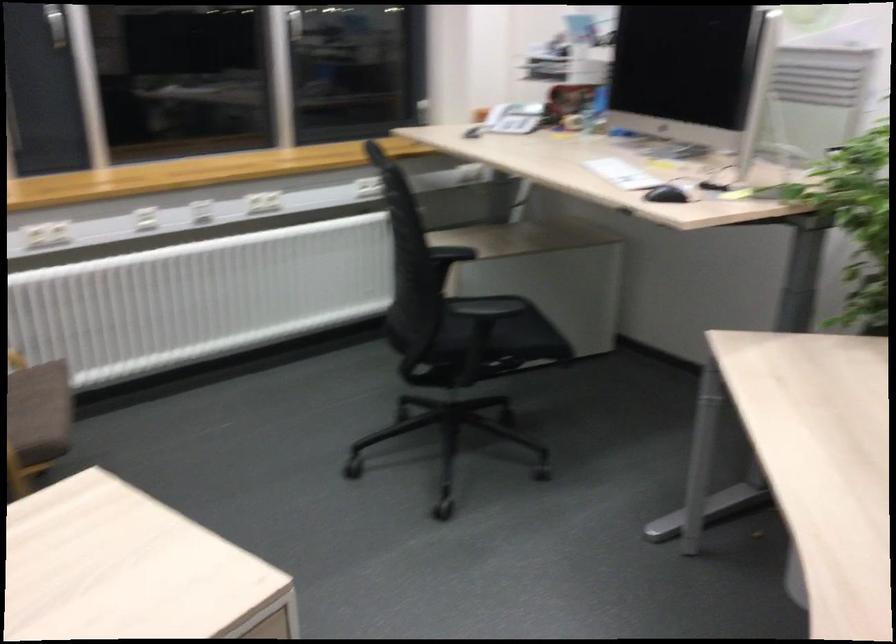
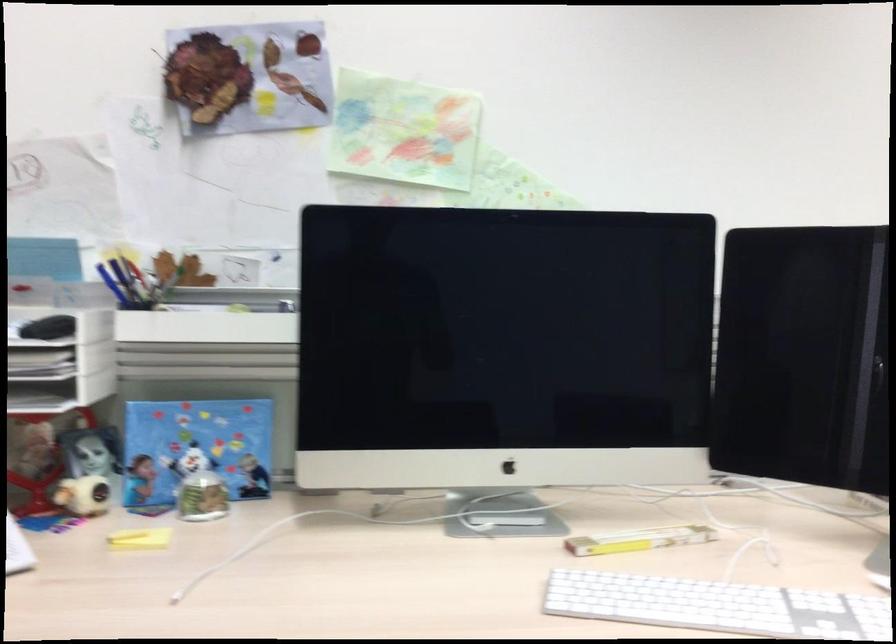
In the second image, find the point that corresponds to [630,169] in the first image.

(717, 605)